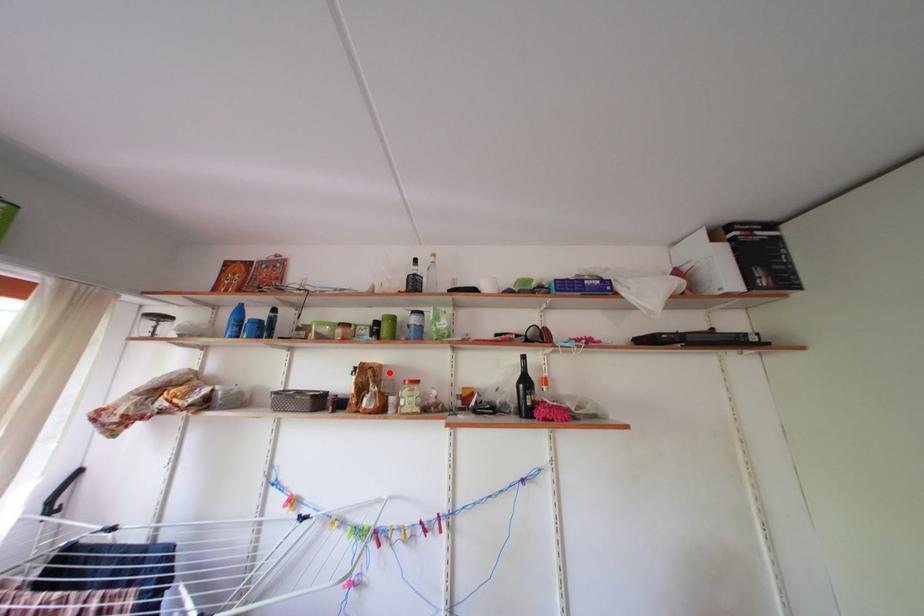
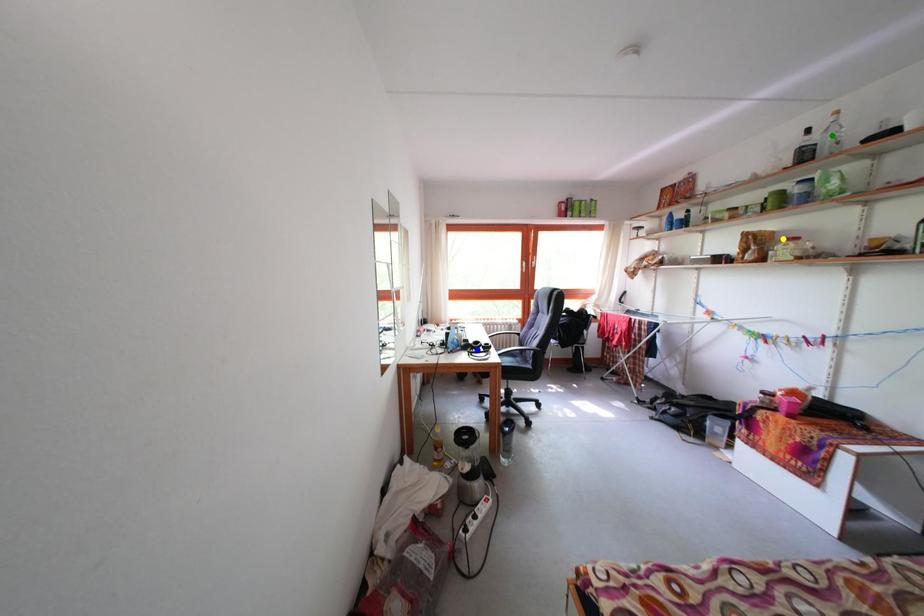
Question: I am providing you with two images of the same scene from different viewpoints. A red point is marked on the first image. You are given multiple points on the second image. Which mark in image 2 goes with the point in image 1?

Choices:
 (A) blue point
 (B) yellow point
 (C) green point

Answer: (B)